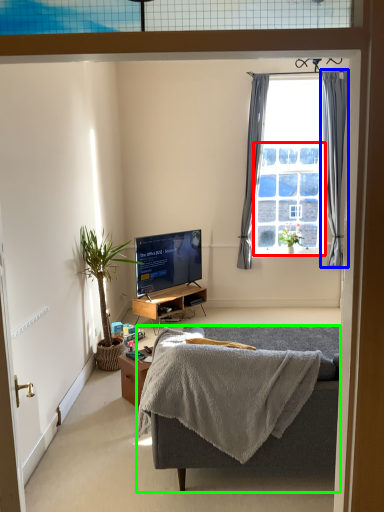
Question: Estimate the real-world distances between objects in this image. Which object is closer to bay window (highlighted by a red box), curtain (highlighted by a blue box) or studio couch (highlighted by a green box)?

Choices:
 (A) curtain
 (B) studio couch

Answer: (A)